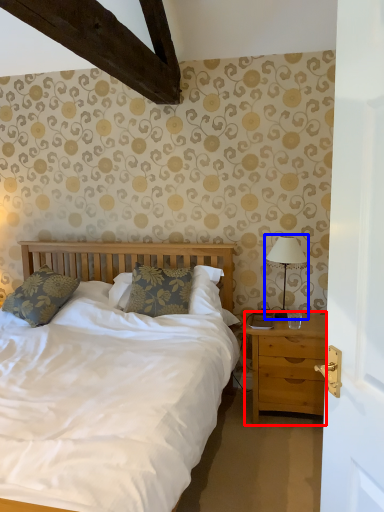
Question: Which object appears closest to the camera in this image, nightstand (highlighted by a red box) or bedside lamp (highlighted by a blue box)?

Choices:
 (A) nightstand
 (B) bedside lamp

Answer: (A)